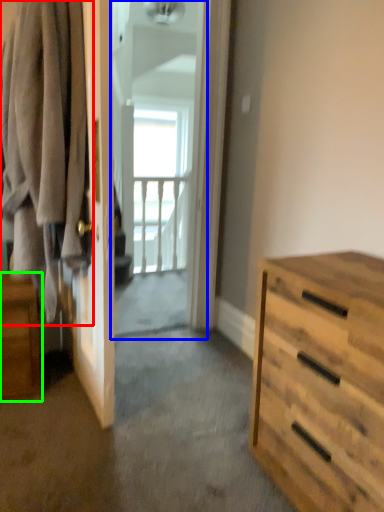
Question: Based on their relative distances, which object is nearer to clothing (highlighted by a red box)? Choose from screen door (highlighted by a blue box) and nightstand (highlighted by a green box).

Choices:
 (A) screen door
 (B) nightstand

Answer: (B)